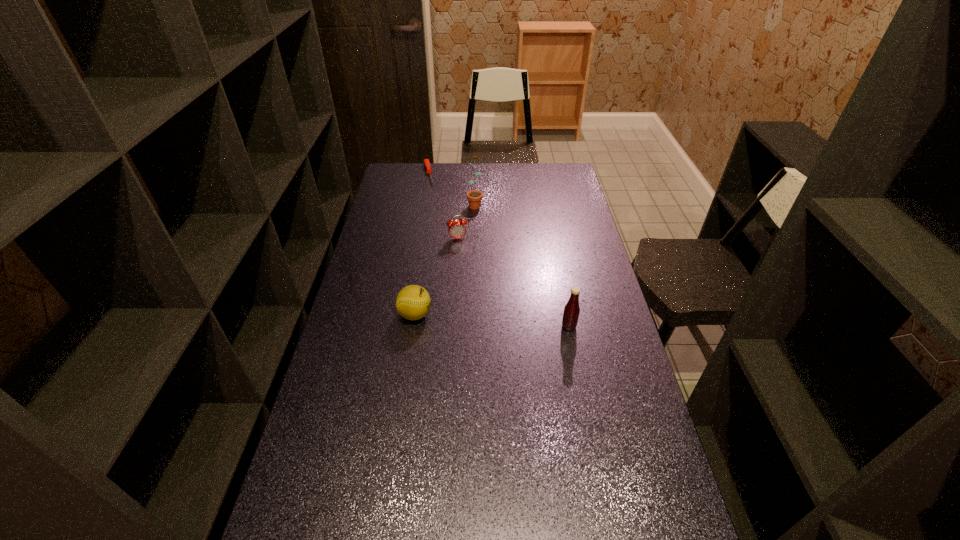
Where is `free spot on the desktop that is between the softball and the fourth shortest object and is positioned on the flower of the sunflower`? free spot on the desktop that is between the softball and the fourth shortest object and is positioned on the flower of the sunflower is located at coordinates (471, 319).

This screenshot has height=540, width=960. What are the coordinates of `free space on the desktop that is between the softball and the Tabasco sauce and is positioned on the face of the third nearest object` in the screenshot? It's located at (478, 319).

At what (x,y) coordinates should I click in order to perform the action: click on free space on the desktop that is between the softball and the fourth shortest object and is positioned at the tip of the farthest object. Please return your answer as a coordinate pair (x, y). Looking at the image, I should click on (470, 319).